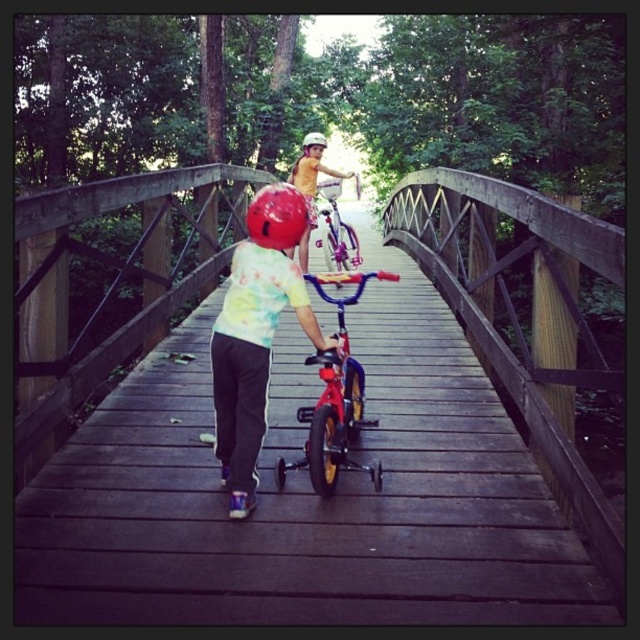
You are standing on the wooden bridge and want to reach the point closer to you. Which point should you head towards, point [333,467] or point [332,172]?

You should head towards point [333,467] because it is closer to you than point [332,172].

You are a photographer standing on the wooden bridge and want to capture a photo of both the matte yellow shirt at center and the white matte helmet at upper center. Which object should you focus on first to ensure both are in frame?

The matte yellow shirt at center is taller than the white matte helmet at upper center, so you should focus on the matte yellow shirt at center first to ensure both are in frame.